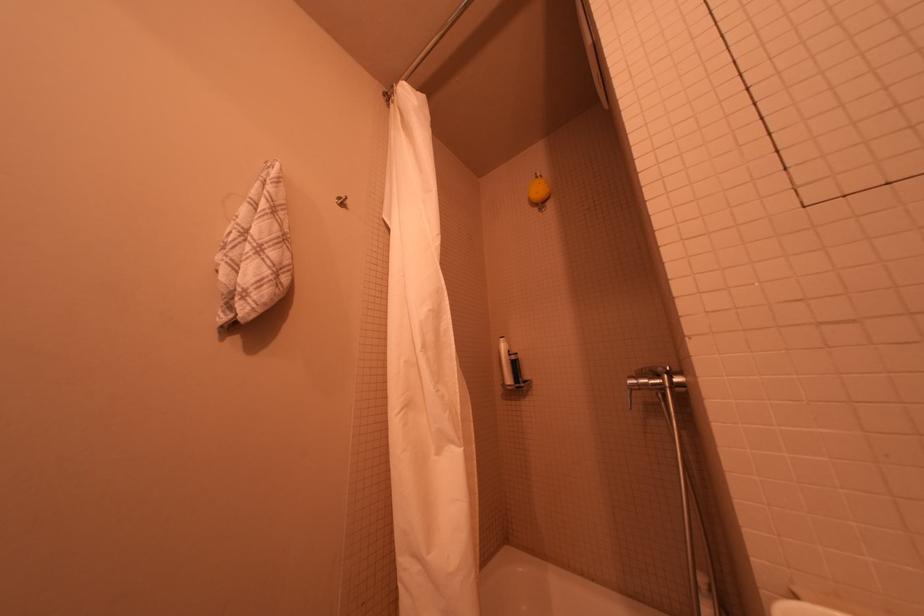
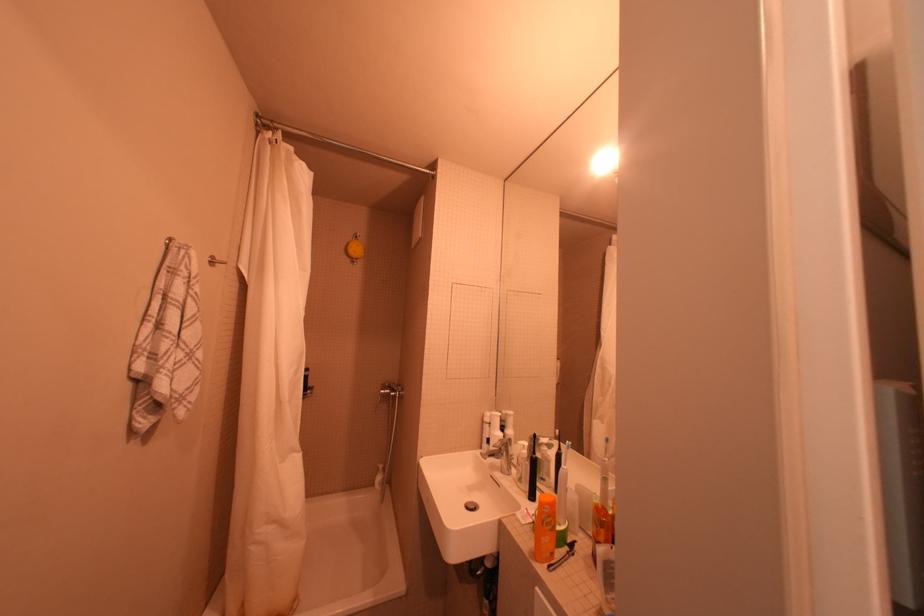
Find the pixel in the second image that matches the point at 544,211 in the first image.

(358, 261)